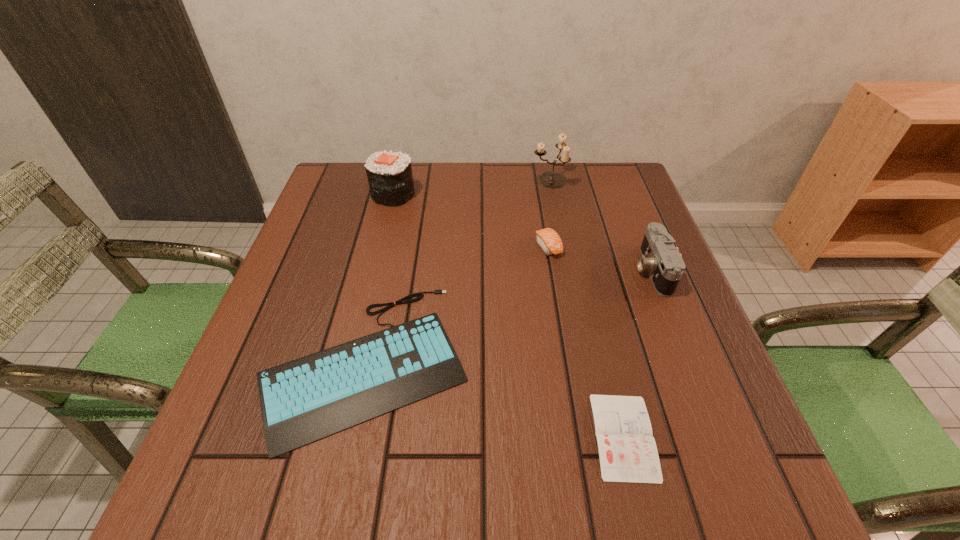
You are a GUI agent. You are given a task and a screenshot of the screen. Output one action in this format:
    pyautogui.click(x=<x>, y=<y>)
    Task: Click on the diary at the near edge
    Image resolution: width=960 pixels, height=540 pixels.
    Given the screenshot: What is the action you would take?
    pyautogui.click(x=628, y=453)

This screenshot has width=960, height=540. I want to click on sushi located in the left edge section of the desktop, so click(389, 174).

Where is `computer keyboard that is positioned at the left edge`? The image size is (960, 540). computer keyboard that is positioned at the left edge is located at coordinates (304, 400).

Identify the location of camera that is at the right edge. (661, 258).

Locate an element on the screen. The width and height of the screenshot is (960, 540). diary that is at the right edge is located at coordinates (628, 453).

You are a GUI agent. You are given a task and a screenshot of the screen. Output one action in this format:
    pyautogui.click(x=<x>, y=<y>)
    Task: Click on the object positioned at the far left corner
    Image resolution: width=960 pixels, height=540 pixels.
    Given the screenshot: What is the action you would take?
    pyautogui.click(x=389, y=174)

At what (x,y) coordinates should I click in order to perform the action: click on object that is at the near left corner. Please return your answer as a coordinate pair (x, y). The width and height of the screenshot is (960, 540). Looking at the image, I should click on (304, 400).

At what (x,y) coordinates should I click in order to perform the action: click on object located at the near right corner. Please return your answer as a coordinate pair (x, y). Image resolution: width=960 pixels, height=540 pixels. Looking at the image, I should click on (628, 453).

The image size is (960, 540). I want to click on free spot at the far edge of the desktop, so click(x=445, y=161).

At what (x,y) coordinates should I click in order to perform the action: click on blank space at the near edge of the desktop. Please return your answer as a coordinate pair (x, y). Looking at the image, I should click on (433, 507).